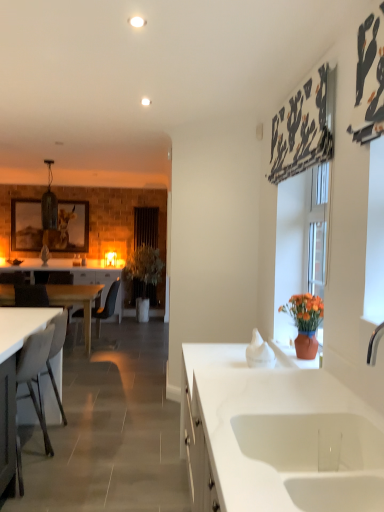
Question: Is wooden framed picture at left wider than white matte desk at lower left, placed as the 2th desk when sorted from left to right?

Choices:
 (A) yes
 (B) no

Answer: (B)

Question: Can you confirm if wooden framed picture at left is positioned to the left of white matte desk at lower left, which is counted as the 1th desk, starting from the front?

Choices:
 (A) yes
 (B) no

Answer: (A)

Question: From a real-world perspective, does wooden framed picture at left sit lower than white matte desk at lower left, the first desk in the right-to-left sequence?

Choices:
 (A) yes
 (B) no

Answer: (B)

Question: Is wooden framed picture at left smaller than white matte desk at lower left, the first desk in the right-to-left sequence?

Choices:
 (A) yes
 (B) no

Answer: (A)

Question: Would you consider wooden framed picture at left to be distant from white matte desk at lower left, the first desk in the right-to-left sequence?

Choices:
 (A) no
 (B) yes

Answer: (B)

Question: Considering the positions of black plastic chair at left and brown leather armchair at left, which is the 2th armchair in right-to-left order, in the image, is black plastic chair at left taller or shorter than brown leather armchair at left, which is the 2th armchair in right-to-left order,?

Choices:
 (A) tall
 (B) short

Answer: (B)

Question: Considering their positions, is black plastic chair at left located in front of or behind brown leather armchair at left, which appears as the 1th armchair when viewed from the back?

Choices:
 (A) front
 (B) behind

Answer: (A)

Question: Looking at their shapes, would you say black plastic chair at left is wider or thinner than brown leather armchair at left, which appears as the 1th armchair when viewed from the back?

Choices:
 (A) thin
 (B) wide

Answer: (B)

Question: Considering the positions of point (114, 302) and point (72, 307), is point (114, 302) closer or farther from the camera than point (72, 307)?

Choices:
 (A) farther
 (B) closer

Answer: (A)

Question: Is black plastic chair at left spatially inside white matte desk at lower left, which is counted as the 1th desk, starting from the front, or outside of it?

Choices:
 (A) outside
 (B) inside

Answer: (A)

Question: Considering the positions of black plastic chair at left and white matte desk at lower left, the first desk in the right-to-left sequence, in the image, is black plastic chair at left bigger or smaller than white matte desk at lower left, the first desk in the right-to-left sequence,?

Choices:
 (A) small
 (B) big

Answer: (B)

Question: In the image, is black plastic chair at left on the left side or the right side of white matte desk at lower left, which is counted as the 1th desk, starting from the front?

Choices:
 (A) left
 (B) right

Answer: (A)

Question: From a real-world perspective, is black plastic chair at left positioned above or below white matte desk at lower left, the first desk in the right-to-left sequence?

Choices:
 (A) above
 (B) below

Answer: (A)

Question: From the image's perspective, is white matte desk at lower left, the first desk in the right-to-left sequence, positioned above or below white wood desk at left, placed as the 1th desk when sorted from back to front?

Choices:
 (A) above
 (B) below

Answer: (B)

Question: Is white matte desk at lower left, the first desk in the right-to-left sequence, bigger or smaller than white wood desk at left, positioned as the first desk in left-to-right order?

Choices:
 (A) small
 (B) big

Answer: (A)